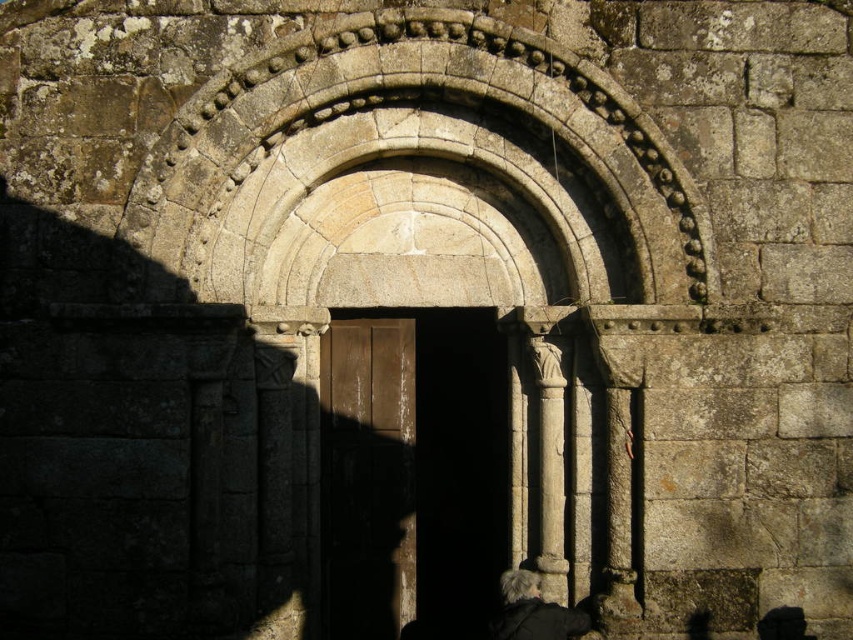
Question: Which point is farther to the camera?

Choices:
 (A) (627, 532)
 (B) (515, 605)

Answer: (A)

Question: Does stone textured arch at center have a larger size compared to smooth stone column at center?

Choices:
 (A) yes
 (B) no

Answer: (A)

Question: Is brown wooden door at center thinner than dark gray wool coat at lower center?

Choices:
 (A) yes
 (B) no

Answer: (A)

Question: Observing the image, what is the correct spatial positioning of smooth stone column at center in reference to dark gray wool coat at lower center?

Choices:
 (A) below
 (B) above

Answer: (B)

Question: Which point is farther to the camera?

Choices:
 (A) (428, 608)
 (B) (614, 604)
 (C) (343, 330)
 (D) (572, 634)

Answer: (A)

Question: Which of the following is the closest to the observer?

Choices:
 (A) smooth wooden door at center
 (B) brown wooden door at center
 (C) smooth stone pillar at right

Answer: (C)